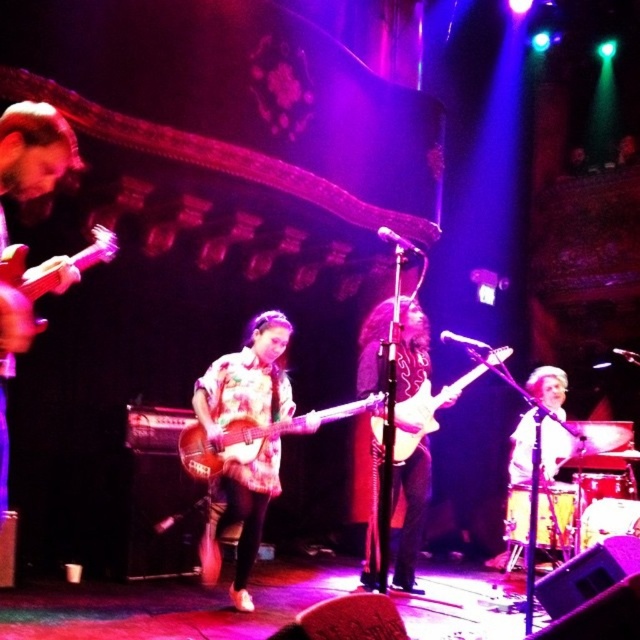
Question: Which object is positioned closest to the floral shirt at center?

Choices:
 (A) shiny black guitar at center
 (B) matte brown acoustic guitar at left
 (C) light brown drum set at lower right
 (D) glossy electric guitar at center

Answer: (A)

Question: Is light brown drum set at lower right bigger than matte brown acoustic guitar at left?

Choices:
 (A) yes
 (B) no

Answer: (A)

Question: Based on their relative distances, which object is farther from the shiny black guitar at center?

Choices:
 (A) tie-dye wood guitar at center
 (B) floral shirt at center

Answer: (B)

Question: Does floral shirt at center appear under matte brown acoustic guitar at left?

Choices:
 (A) yes
 (B) no

Answer: (A)

Question: Considering the relative positions of shiny black guitar at center and light brown drum set at lower right in the image provided, where is shiny black guitar at center located with respect to light brown drum set at lower right?

Choices:
 (A) above
 (B) below

Answer: (B)

Question: Which object is the closest to the glossy electric guitar at center?

Choices:
 (A) tie-dye wood guitar at center
 (B) light brown drum set at lower right
 (C) shiny black guitar at center
 (D) floral shirt at center

Answer: (C)